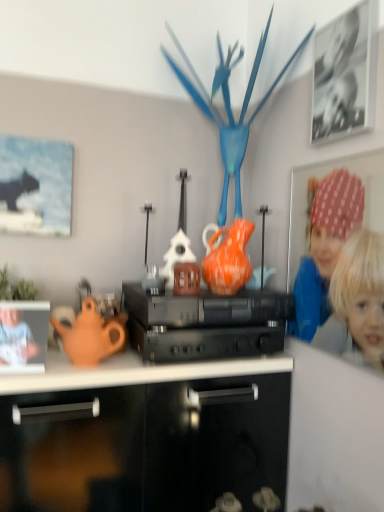
Find the location of a particular element. matte orange teapot at left is located at coordinates pyautogui.click(x=91, y=335).

Identify the location of black plastic stereo at center. (205, 324).

Describe the element at coordinates (325, 248) in the screenshot. The height and width of the screenshot is (512, 384). I see `polka dot fabric at upper right, arranged as the first person when viewed from the right` at that location.

Identify the location of blue glossy bird at center. (229, 109).

Measure the distance between point (x=32, y=345) and camera.

Point (x=32, y=345) and camera are 3.62 feet apart from each other.

At what (x,y) coordinates should I click in order to perform the action: click on black matte picture frame at upper right, which is the 2th picture frame from left to right. Please return your answer as a coordinate pair (x, y). Image resolution: width=384 pixels, height=512 pixels. Looking at the image, I should click on (343, 74).

In the scene shown: Is black plastic stereo at center surrounded by matte black cat at upper left, which is counted as the 2th picture frame, starting from the front?

No, black plastic stereo at center is located outside of matte black cat at upper left, which is counted as the 2th picture frame, starting from the front.

Considering the relative sizes of matte black cat at upper left, marked as the 1th picture frame in a left-to-right arrangement, and black plastic stereo at center in the image provided, is matte black cat at upper left, marked as the 1th picture frame in a left-to-right arrangement, wider than black plastic stereo at center?

No, matte black cat at upper left, marked as the 1th picture frame in a left-to-right arrangement, is not wider than black plastic stereo at center.

From the image's perspective, is matte black cat at upper left, marked as the 1th picture frame in a left-to-right arrangement, located beneath black plastic stereo at center?

Actually, matte black cat at upper left, marked as the 1th picture frame in a left-to-right arrangement, appears above black plastic stereo at center in the image.

In the scene shown: Between orange glazed earthenware teapot at center and black plastic stereo at center, which one has smaller width?

orange glazed earthenware teapot at center.

Could you tell me if orange glazed earthenware teapot at center is facing black plastic stereo at center?

No, orange glazed earthenware teapot at center is not aimed at black plastic stereo at center.

In terms of size, does orange glazed earthenware teapot at center appear bigger or smaller than black plastic stereo at center?

Clearly, orange glazed earthenware teapot at center is smaller in size than black plastic stereo at center.

Is black matte picture frame at upper right, the 2th picture frame in the bottom-to-top sequence, wider than matte orange teapot at left?

In fact, black matte picture frame at upper right, the 2th picture frame in the bottom-to-top sequence, might be narrower than matte orange teapot at left.

Which is more to the right, black matte picture frame at upper right, which is the 2th picture frame from left to right, or matte orange teapot at left?

black matte picture frame at upper right, which is the 2th picture frame from left to right, is more to the right.

From a real-world perspective, is black matte picture frame at upper right, which is the 2th picture frame from left to right, physically located above or below matte orange teapot at left?

Clearly, from a real-world perspective, black matte picture frame at upper right, which is the 2th picture frame from left to right, is above matte orange teapot at left.

Which object is further away from the camera taking this photo, orange glazed earthenware teapot at center or black matte picture frame at upper right, which appears as the 1th picture frame when viewed from the front?

orange glazed earthenware teapot at center is behind.

From a real-world perspective, is orange glazed earthenware teapot at center on top of black matte picture frame at upper right, which is the 2th picture frame from left to right?

No.

Does orange glazed earthenware teapot at center turn towards black matte picture frame at upper right, the 2th picture frame in the bottom-to-top sequence?

No, orange glazed earthenware teapot at center is not facing towards black matte picture frame at upper right, the 2th picture frame in the bottom-to-top sequence.

Which is in front, point (203, 260) or point (333, 79)?

The point (333, 79) is more forward.

Does point (325, 279) appear closer or farther from the camera than point (340, 121)?

Point (325, 279).

From a real-world perspective, is polka dot fabric at upper right, arranged as the first person when viewed from the right, positioned over black matte picture frame at upper right, the 2th picture frame in the bottom-to-top sequence, based on gravity?

Incorrect, from a real-world perspective, polka dot fabric at upper right, arranged as the first person when viewed from the right, is lower than black matte picture frame at upper right, the 2th picture frame in the bottom-to-top sequence.

Considering the positions of objects matte orange teapot at left and black matte picture frame at upper right, marked as the second picture frame in a back-to-front arrangement, in the image provided, who is more to the right, matte orange teapot at left or black matte picture frame at upper right, marked as the second picture frame in a back-to-front arrangement,?

black matte picture frame at upper right, marked as the second picture frame in a back-to-front arrangement, is more to the right.

Does matte orange teapot at left come behind black matte picture frame at upper right, which is the 2th picture frame from left to right?

Yes, matte orange teapot at left is behind black matte picture frame at upper right, which is the 2th picture frame from left to right.

Is matte orange teapot at left taller than black matte picture frame at upper right, the 2th picture frame in the bottom-to-top sequence?

No, matte orange teapot at left is not taller than black matte picture frame at upper right, the 2th picture frame in the bottom-to-top sequence.

The width and height of the screenshot is (384, 512). I want to click on picture frame in front of the matte orange teapot at left, so point(343,74).

Considering the relative sizes of black plastic stereo at center and matte orange teapot at left in the image provided, is black plastic stereo at center bigger than matte orange teapot at left?

Yes, black plastic stereo at center is bigger than matte orange teapot at left.

How far apart are black plastic stereo at center and matte orange teapot at left?

9.23 inches.

From a real-world perspective, is black plastic stereo at center physically below matte orange teapot at left?

No, from a real-world perspective, black plastic stereo at center is not below matte orange teapot at left.

Would you say black plastic stereo at center is a long distance from matte orange teapot at left?

No, black plastic stereo at center is in close proximity to matte orange teapot at left.

Where is `picture frame on the left of black plastic stereo at center`? The image size is (384, 512). picture frame on the left of black plastic stereo at center is located at coordinates pos(35,186).

What are the coordinates of `tea pot that appears on the right of black plastic stereo at center` in the screenshot? It's located at (227, 257).

Looking at the image, which one is located closer to black plastic stereo at center, matte black cat at upper left, which is counted as the 2th picture frame, starting from the front, or matte orange teapot at left?

matte orange teapot at left.

When comparing their distances from polka dot fabric at upper right, arranged as the first person when viewed from the right, does orange glazed earthenware teapot at center or blue glossy bird at center seem closer?

orange glazed earthenware teapot at center lies closer to polka dot fabric at upper right, arranged as the first person when viewed from the right, than the other object.

Based on their spatial positions, is polka dot fabric at upper right, arranged as the first person when viewed from the right, or matte orange teapot at left, positioned as the second person in right-to-left order, closer to black matte picture frame at upper right, the 1th picture frame from the right?

polka dot fabric at upper right, arranged as the first person when viewed from the right.

Which object lies further to the anchor point matte black cat at upper left, the 2th picture frame from the top, black matte picture frame at upper right, which is the first picture frame from top to bottom, or blue glossy bird at center?

The object further to matte black cat at upper left, the 2th picture frame from the top, is black matte picture frame at upper right, which is the first picture frame from top to bottom.

Consider the image. Estimate the real-world distances between objects in this image. Which object is closer to orange glazed earthenware teapot at center, matte orange teapot at left, the 1th person positioned from the left, or black matte picture frame at upper right, which is the 2th picture frame from left to right?

black matte picture frame at upper right, which is the 2th picture frame from left to right, is positioned closer to the anchor orange glazed earthenware teapot at center.

Looking at the image, which one is located closer to matte orange teapot at left, polka dot fabric at upper right, acting as the second person starting from the left, or matte black cat at upper left, which is counted as the 2th picture frame, starting from the right?

matte black cat at upper left, which is counted as the 2th picture frame, starting from the right, is positioned closer to the anchor matte orange teapot at left.

When comparing their distances from black plastic stereo at center, does orange glazed earthenware teapot at center or blue glossy bird at center seem closer?

Based on the image, orange glazed earthenware teapot at center appears to be nearer to black plastic stereo at center.

Looking at the image, which one is located closer to matte orange teapot at left, matte black cat at upper left, which ranks as the 1th picture frame in bottom-to-top order, or polka dot fabric at upper right, arranged as the first person when viewed from the right?

The object closer to matte orange teapot at left is matte black cat at upper left, which ranks as the 1th picture frame in bottom-to-top order.

What are the coordinates of `tea pot situated between matte orange teapot at left, positioned as the second person in right-to-left order, and black matte picture frame at upper right, which is the 2th picture frame from left to right, from left to right` in the screenshot? It's located at (227, 257).

At what (x,y) coordinates should I click in order to perform the action: click on toy between black matte picture frame at upper right, which is the first picture frame from top to bottom, and black plastic stereo at center, in the vertical direction. Please return your answer as a coordinate pair (x, y). The height and width of the screenshot is (512, 384). Looking at the image, I should click on (229, 109).

What are the coordinates of `toy between matte orange teapot at left, positioned as the second person in right-to-left order, and polka dot fabric at upper right, arranged as the first person when viewed from the right` in the screenshot? It's located at tap(229, 109).

At what (x,y) coordinates should I click in order to perform the action: click on appliance between black matte picture frame at upper right, the 1th picture frame from the right, and matte orange teapot at left in the up-down direction. Please return your answer as a coordinate pair (x, y). Looking at the image, I should click on (205, 324).